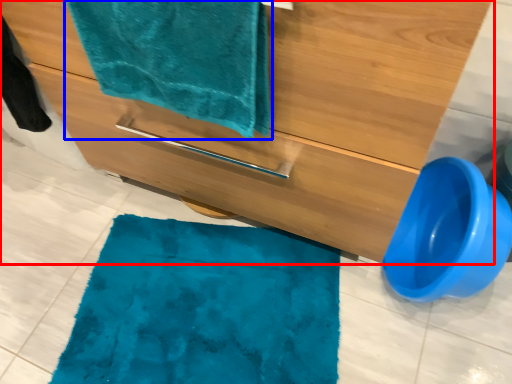
Question: Which object is closer to the camera taking this photo, bathroom cabinet (highlighted by a red box) or towel (highlighted by a blue box)?

Choices:
 (A) bathroom cabinet
 (B) towel

Answer: (A)